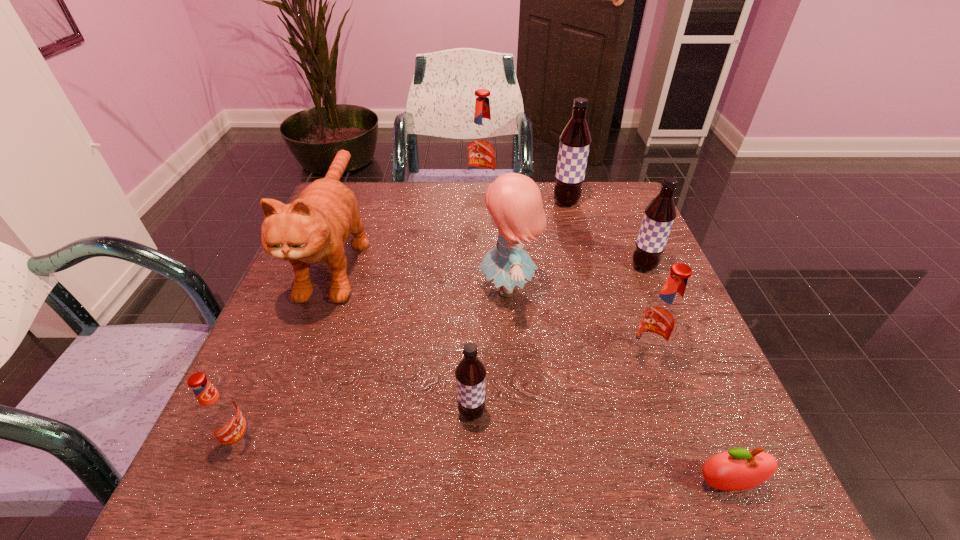
The image size is (960, 540). What are the coordinates of `blank area in the image that satisfies the following two spatial constraints: 1. on the front side of the farthest red root beer; 2. on the left side of the biggest brown root beer` in the screenshot? It's located at (482, 202).

Image resolution: width=960 pixels, height=540 pixels. I want to click on vacant space that satisfies the following two spatial constraints: 1. on the face of the orange cat; 2. on the left side of the fifth farthest root beer, so click(x=278, y=413).

This screenshot has width=960, height=540. I want to click on free space in the image that satisfies the following two spatial constraints: 1. on the back side of the leftmost red root beer; 2. on the right side of the second root beer from right to left, so click(x=275, y=361).